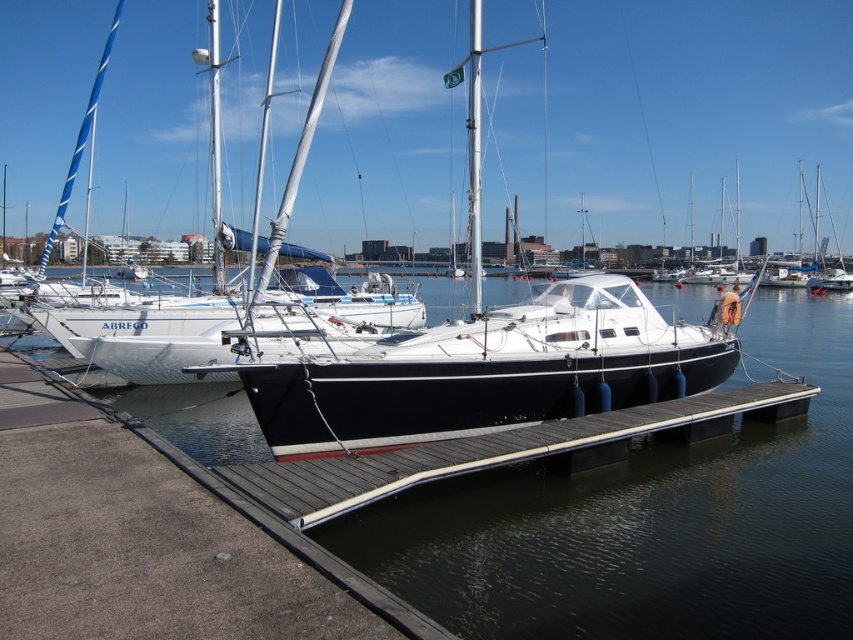
Looking at this image, you are a photographer planning to take a wide shot of the white glossy sailboat at center and the smooth wood dock at center. Based on their sizes, which object would appear narrower in the photo?

The white glossy sailboat at center appears narrower in the photo because it has a lesser width compared to the smooth wood dock at center.

Consider the image. You are standing at the edge of the wooden pier looking towards the white sailboat named ABREGO. There are two points marked on the water surface in front of you. The first point is at coordinate point (508, 525) and the second is at point (306, 444). Which of these two points is closer to you?

Point (508, 525) is in front of point (306, 444), so it is closer to you.